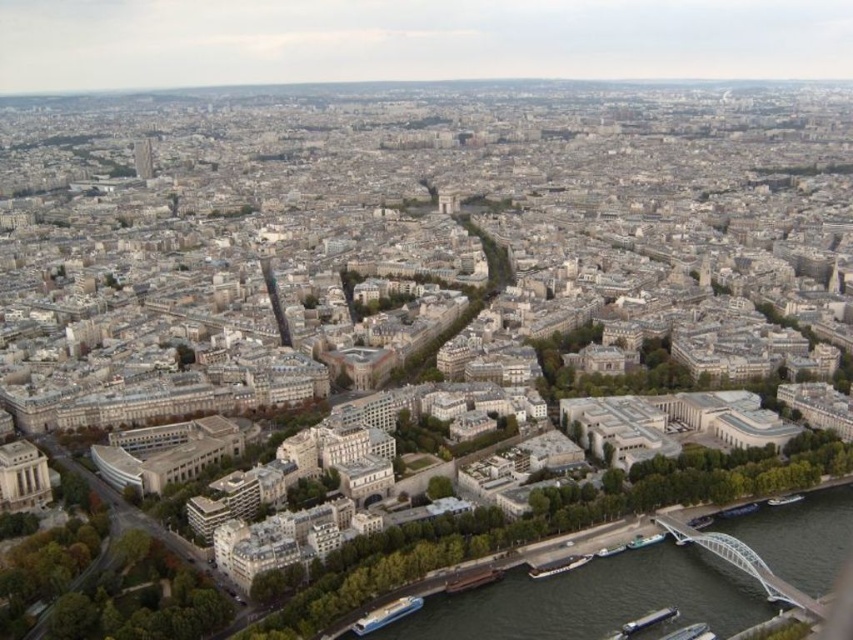
You are a drone operator trying to capture a photo of the dark gray concrete river at lower right. The drone is currently at coordinates point 0.8, 0.7. To ensure the river is centered in the photo, should you move the drone north or south?

The dark gray concrete river at lower right is at point (592,600). Since the drone is at (596,512), which has a lower y coordinate, the river is south of the drone. To center it, move the drone south.

You are a drone operator flying over the city. Your drone is currently above the dark gray concrete river at lower right and you want to take a photo of the smooth concrete tower at upper left. Since the river is blocking the view, can you fly your drone over the river to capture the tower in the background?

The dark gray concrete river at lower right is in front of the smooth concrete tower at upper left, so yes, you can fly your drone over the river to capture the tower in the background as it is positioned behind the river.

You are a tourist standing at the riverbank looking towards the city skyline. You see the shiny metallic eiffel tower at center and the smooth concrete tower at upper left. Which tower appears larger in your view?

The shiny metallic eiffel tower at center appears larger because it is closer to you than the smooth concrete tower at upper left.